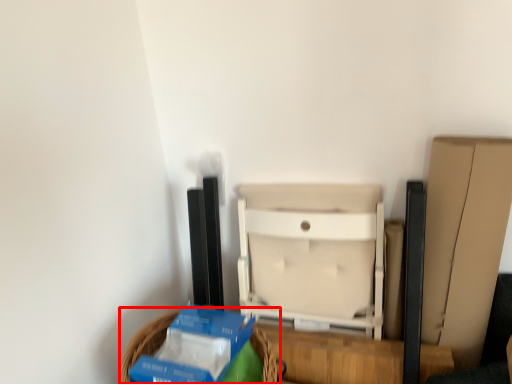
Question: From the image's perspective, where is basket (annotated by the red box) located relative to furniture?

Choices:
 (A) above
 (B) below

Answer: (B)